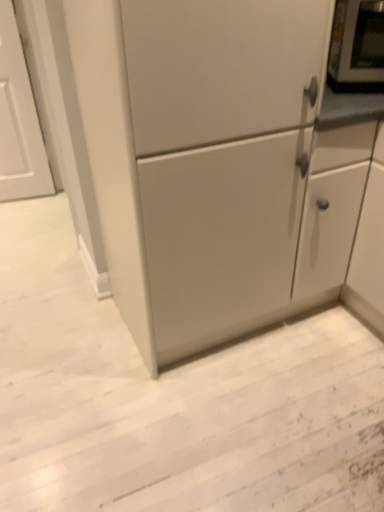
Question: From the image's perspective, is matte white cabinet at center below metallic silver microwave at upper right?

Choices:
 (A) yes
 (B) no

Answer: (A)

Question: Is matte white cabinet at center at the right side of metallic silver microwave at upper right?

Choices:
 (A) no
 (B) yes

Answer: (A)

Question: Is matte white cabinet at center turned away from metallic silver microwave at upper right?

Choices:
 (A) no
 (B) yes

Answer: (A)

Question: Does matte white cabinet at center appear on the left side of metallic silver microwave at upper right?

Choices:
 (A) no
 (B) yes

Answer: (B)

Question: From a real-world perspective, is matte white cabinet at center physically above metallic silver microwave at upper right?

Choices:
 (A) no
 (B) yes

Answer: (A)

Question: From the image's perspective, would you say matte white cabinet at center is positioned over metallic silver microwave at upper right?

Choices:
 (A) no
 (B) yes

Answer: (A)

Question: From a real-world perspective, is metallic silver microwave at upper right positioned over matte white cabinet at center based on gravity?

Choices:
 (A) no
 (B) yes

Answer: (B)

Question: Would you say metallic silver microwave at upper right is outside matte white cabinet at center?

Choices:
 (A) no
 (B) yes

Answer: (B)

Question: Are metallic silver microwave at upper right and matte white cabinet at center far apart?

Choices:
 (A) no
 (B) yes

Answer: (A)

Question: Is metallic silver microwave at upper right oriented away from matte white cabinet at center?

Choices:
 (A) no
 (B) yes

Answer: (A)

Question: Can you confirm if metallic silver microwave at upper right is smaller than matte white cabinet at center?

Choices:
 (A) yes
 (B) no

Answer: (A)

Question: Considering the relative sizes of metallic silver microwave at upper right and matte white cabinet at center in the image provided, is metallic silver microwave at upper right thinner than matte white cabinet at center?

Choices:
 (A) yes
 (B) no

Answer: (A)

Question: From a real-world perspective, is metallic silver microwave at upper right positioned above or below matte white cabinet at center?

Choices:
 (A) above
 (B) below

Answer: (A)